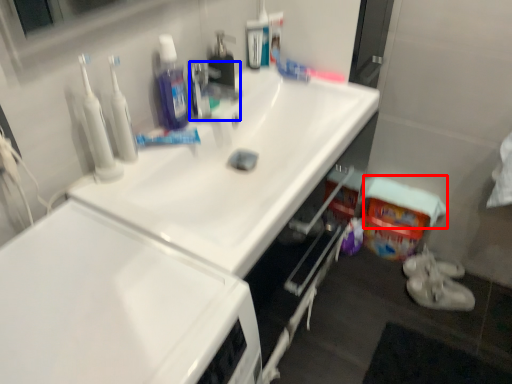
Question: Among these objects, which one is farthest to the camera, towel/napkin (highlighted by a red box) or faucet (highlighted by a blue box)?

Choices:
 (A) towel/napkin
 (B) faucet

Answer: (A)